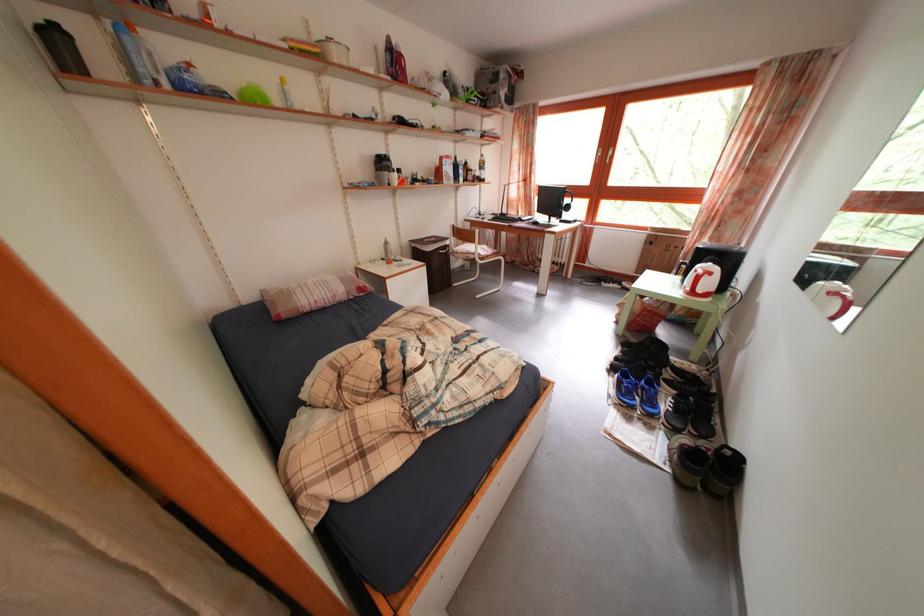
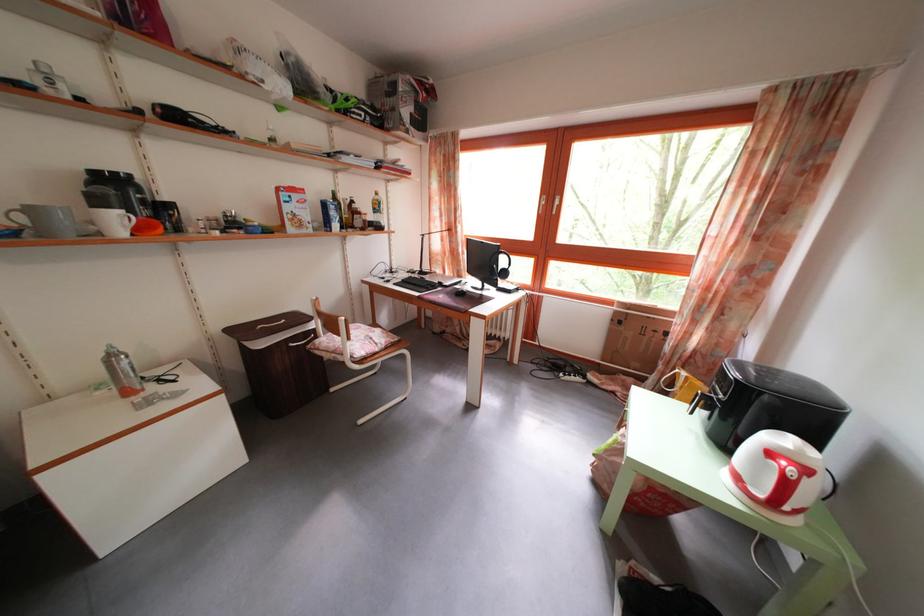
The point at (x=560, y=207) is marked in the first image. Where is the corresponding point in the second image?

(492, 265)